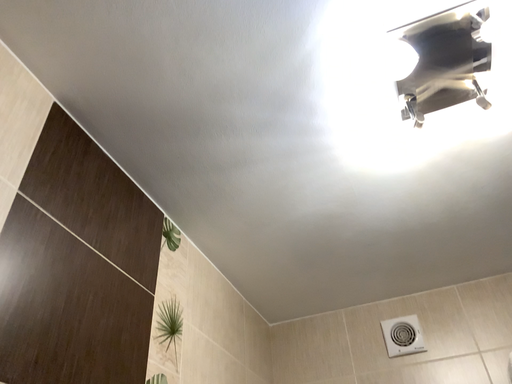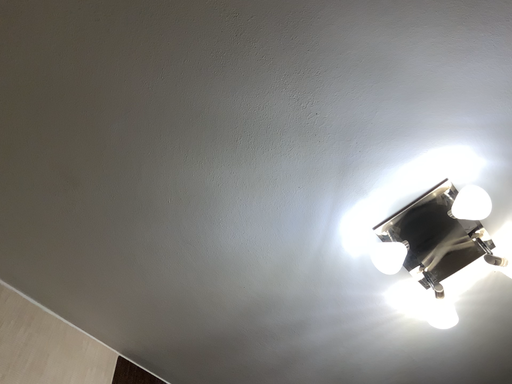
Question: How did the camera likely rotate when shooting the video?

Choices:
 (A) rotated upward
 (B) rotated downward

Answer: (A)